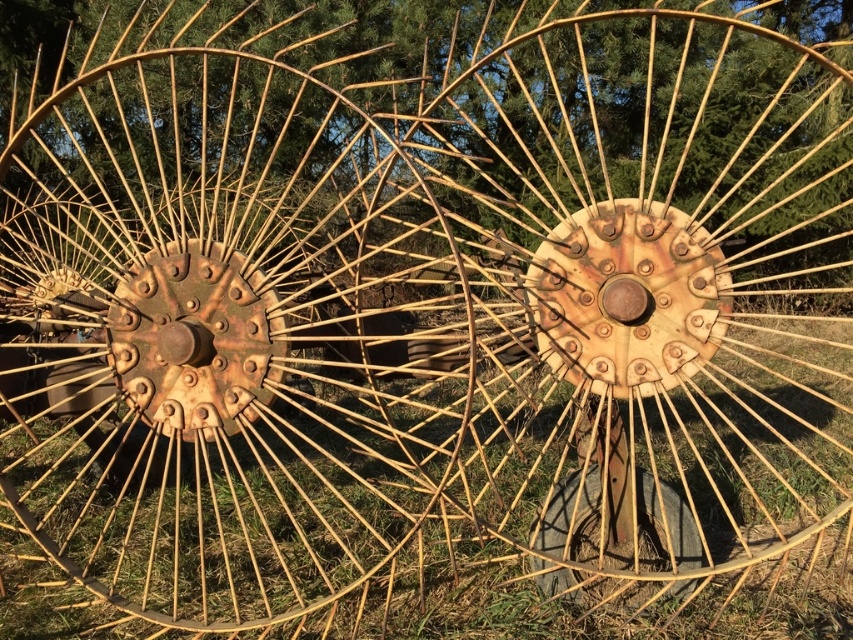
You are a farmer inspecting old equipment. You notice the rusty metallic spokes at center and the rusty metal tire at center. Based on their widths, which one could potentially support a heavier load?

The rusty metallic spokes at center might be wider than rusty metal tire at center, so they could potentially support a heavier load.

You are standing in front of the agricultural implements and want to place a small tool exactly halfway between point (680,465) and point (140,390). Will the tool be closer to the viewer or farther away compared to the average depth of the two points?

The tool placed halfway between point (680,465) and point (140,390) will be closer to the viewer than the average depth of the two points because point (680,465) is further to the viewer than point (140,390).